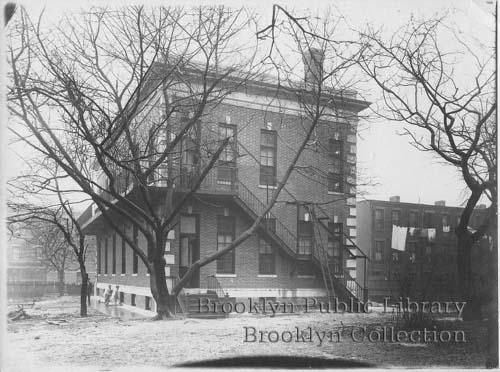
Find the location of `chimney`. chimney is located at coordinates (310, 76).